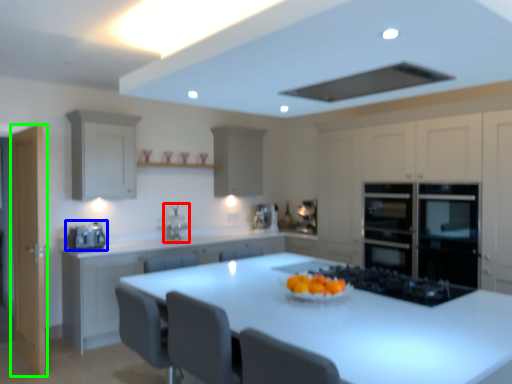
Question: Which object is positioned closest to sink (highlighted by a red box)? Select from home appliance (highlighted by a blue box) and glass door (highlighted by a green box).

Choices:
 (A) home appliance
 (B) glass door

Answer: (A)